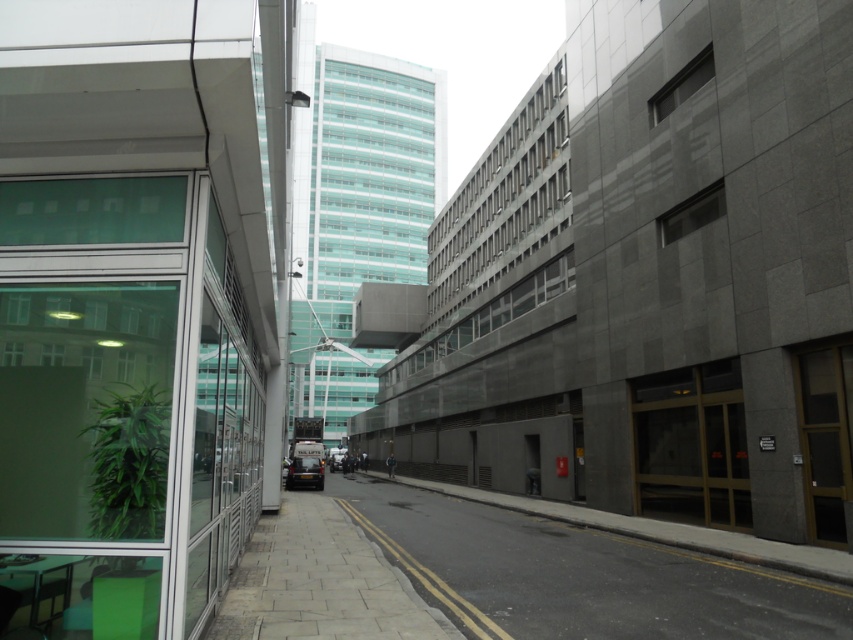
Question: Is smooth concrete pavement at center closer to camera compared to metallic silver van at center?

Choices:
 (A) yes
 (B) no

Answer: (A)

Question: Among these points, which one is farthest from the camera?

Choices:
 (A) (770, 605)
 (B) (314, 580)

Answer: (B)

Question: Does paved stone sidewalk at lower left appear over metallic silver van at center?

Choices:
 (A) yes
 (B) no

Answer: (A)

Question: Which is nearer to the smooth concrete pavement at center?

Choices:
 (A) metallic silver van at center
 (B) paved stone sidewalk at lower left

Answer: (B)

Question: Can you confirm if paved stone sidewalk at lower left is positioned below metallic silver van at center?

Choices:
 (A) yes
 (B) no

Answer: (B)

Question: Which object appears farthest from the camera in this image?

Choices:
 (A) smooth concrete pavement at center
 (B) metallic silver van at center
 (C) paved stone sidewalk at lower left

Answer: (B)